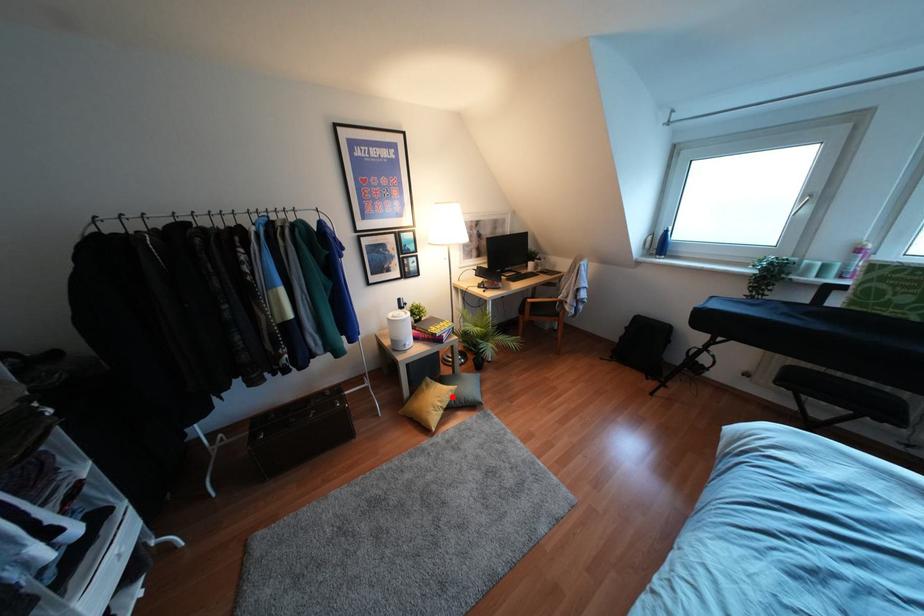
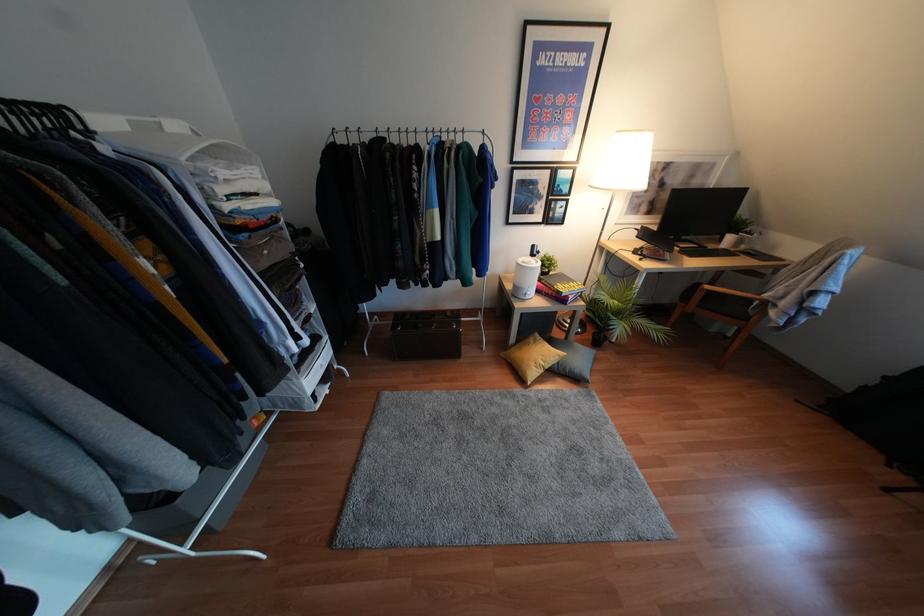
Question: A red point is marked in image1. In image2, is the corresponding 3D point closer to the camera or farther? Reply with the corresponding letter.

Choices:
 (A) The corresponding 3D point is closer.
 (B) The corresponding 3D point is farther.

Answer: (B)